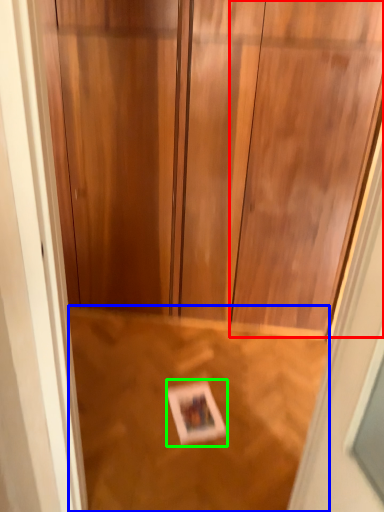
Question: Considering the real-world distances, which object is farthest from door (highlighted by a red box)? plywood (highlighted by a blue box) or postcard (highlighted by a green box)?

Choices:
 (A) plywood
 (B) postcard

Answer: (B)